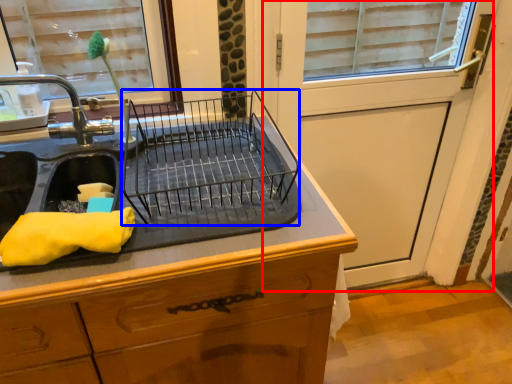
Question: Which point is closer to the camera, screen door (highlighted by a red box) or appliance (highlighted by a blue box)?

Choices:
 (A) screen door
 (B) appliance

Answer: (B)